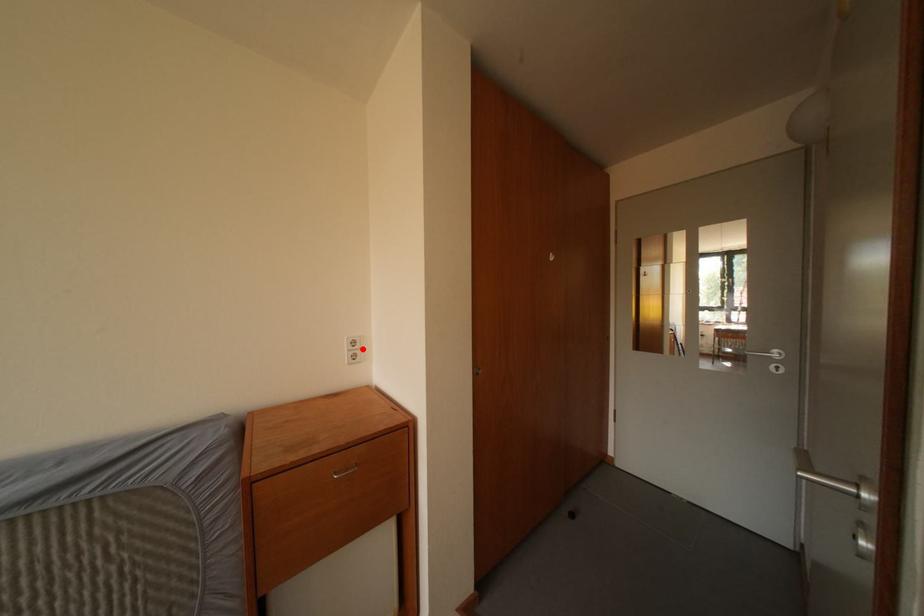
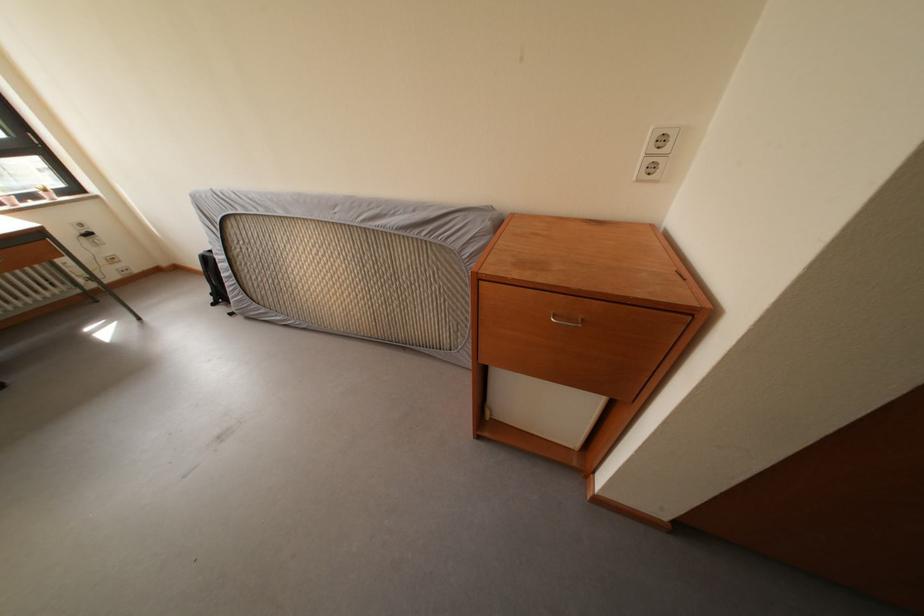
Find the pixel in the second image that matches the highlighted location in the first image.

(671, 147)